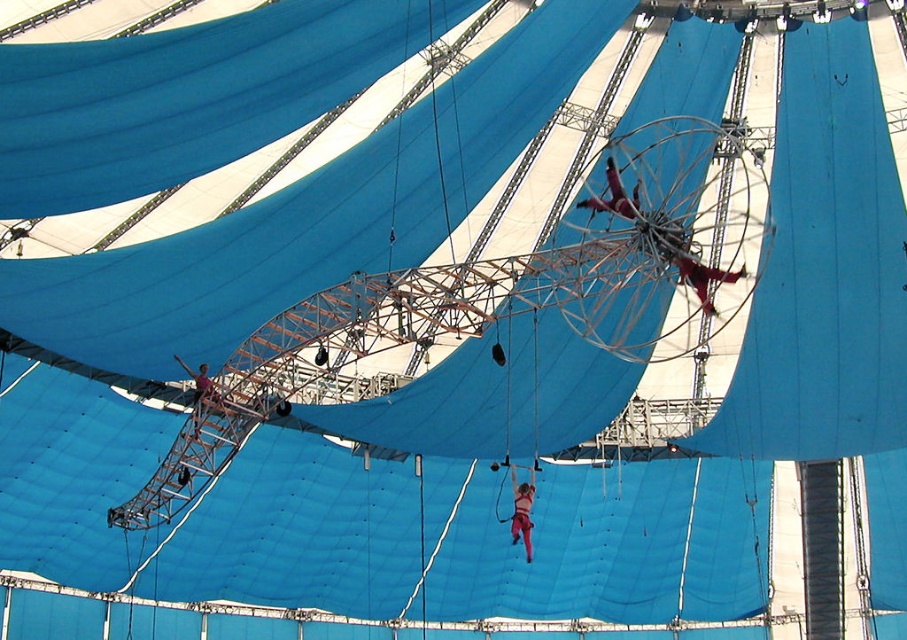
Can you confirm if metallic silver trapeze at upper center is positioned below metallic red trapeze artist at center?

Indeed, metallic silver trapeze at upper center is positioned under metallic red trapeze artist at center.

Which is above, metallic silver trapeze at upper center or metallic red trapeze artist at center?

metallic red trapeze artist at center

Does point (681, 248) come behind point (628, 202)?

That is False.

Where is `metallic silver trapeze at upper center`? metallic silver trapeze at upper center is located at coordinates (696, 272).

Is metallic silver trapeze at upper center bigger than matte pink harness at center?

Yes, metallic silver trapeze at upper center is bigger than matte pink harness at center.

Is metallic silver trapeze at upper center in front of matte pink harness at center?

Yes, it is.

Identify the location of metallic silver trapeze at upper center. This screenshot has height=640, width=907. (696, 272).

Is the position of metallic red trapeze artist at center less distant than that of matte pink harness at center?

Yes.

Which is more to the left, metallic red trapeze artist at center or matte pink harness at center?

From the viewer's perspective, matte pink harness at center appears more on the left side.

The image size is (907, 640). In order to click on metallic red trapeze artist at center in this screenshot , I will do `click(613, 195)`.